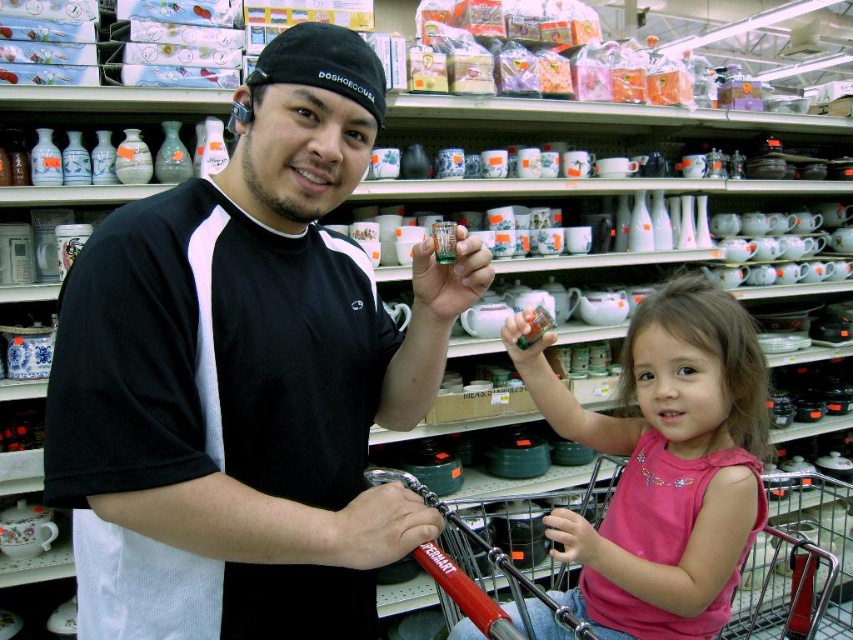
Can you confirm if black matte shirt at center is smaller than metallic red shopping cart at lower center?

Yes, black matte shirt at center is smaller than metallic red shopping cart at lower center.

Which is behind, point (107, 579) or point (537, 528)?

The point (537, 528) is behind.

Is point (175, 595) more distant than point (759, 602)?

That is False.

The width and height of the screenshot is (853, 640). I want to click on black matte shirt at center, so coord(245,378).

Who is positioned more to the right, black matte shirt at center or pink fabric shirt at center?

From the viewer's perspective, pink fabric shirt at center appears more on the right side.

Measure the distance between black matte shirt at center and pink fabric shirt at center.

The distance of black matte shirt at center from pink fabric shirt at center is 17.25 inches.

Locate an element on the screen. The image size is (853, 640). black matte shirt at center is located at coordinates (245, 378).

Describe the element at coordinates (664, 465) in the screenshot. I see `pink fabric shirt at center` at that location.

Can you confirm if pink fabric shirt at center is shorter than metallic red shopping cart at lower center?

Correct, pink fabric shirt at center is not as tall as metallic red shopping cart at lower center.

Is point (651, 492) positioned after point (808, 500)?

No, (651, 492) is in front of (808, 500).

Locate an element on the screen. pink fabric shirt at center is located at coordinates (664, 465).